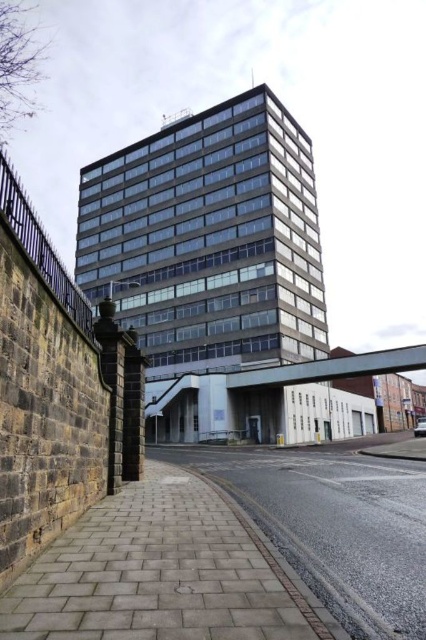
You are a delivery person who needs to park your van on the gray concrete pavement at lower left or the paved brick sidewalk at lower center. Which parking area has a smaller size and might be less suitable for a larger vehicle?

The gray concrete pavement at lower left has a smaller size compared to the paved brick sidewalk at lower center, so it might be less suitable for a larger vehicle.

Consider the image. You are standing at the base of the building and notice the gray concrete pavement at lower left and the paved brick sidewalk at lower center. Which surface is lower in elevation?

The gray concrete pavement at lower left has a lesser height compared to the paved brick sidewalk at lower center, so it is lower in elevation.

You are a delivery person trying to park your 1.2 meter wide delivery cart near the building. You have two options for parking areas shown in the image. Which parking area, the gray concrete pavement at lower left or the paved brick sidewalk at lower center, is wider and can accommodate your cart?

The paved brick sidewalk at lower center is wider than the gray concrete pavement at lower left, so it can accommodate your 1.2 meter wide delivery cart.